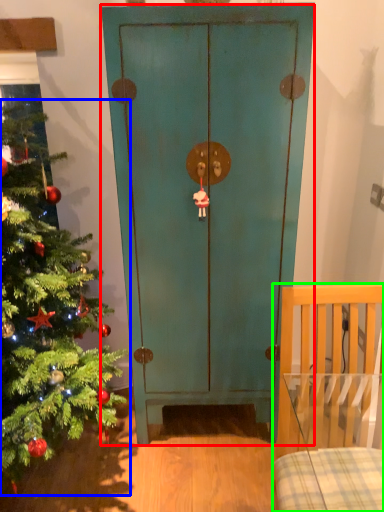
Question: Which is nearer to the door (highlighted by a red box)? christmas tree (highlighted by a blue box) or furniture (highlighted by a green box).

Choices:
 (A) christmas tree
 (B) furniture

Answer: (A)